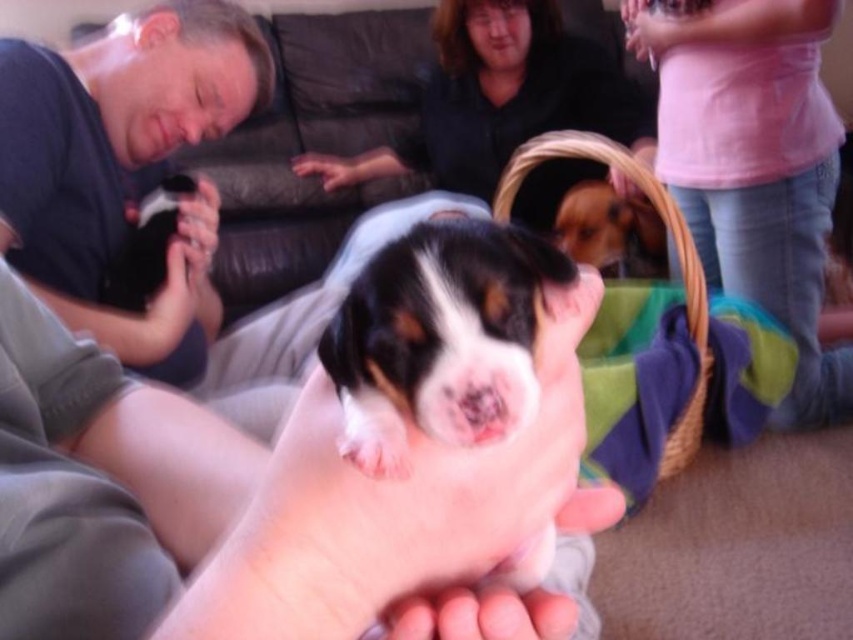
Question: Observing the image, what is the correct spatial positioning of soft black fur at center in reference to matte pink hand at upper center?

Choices:
 (A) above
 (B) below

Answer: (B)

Question: Estimate the real-world distances between objects in this image. Which object is farther from the soft black fur at center?

Choices:
 (A) brown fur basket at upper center
 (B) matte pink hand at upper center
 (C) pink cotton shirt at upper right
 (D) matte black shirt at left

Answer: (C)

Question: Which point appears farthest from the camera in this image?

Choices:
 (A) (183, 54)
 (B) (628, 32)
 (C) (497, 397)
 (D) (556, 156)

Answer: (B)

Question: Observing the image, what is the correct spatial positioning of white fur puppy at center in reference to woven straw basket at upper center?

Choices:
 (A) below
 (B) above

Answer: (A)

Question: Is matte black shirt at left further to the viewer compared to white fur puppy at center?

Choices:
 (A) no
 (B) yes

Answer: (B)

Question: Which point is farther to the camera?

Choices:
 (A) (767, 180)
 (B) (654, 188)
 (C) (218, 1)
 (D) (633, 269)

Answer: (D)